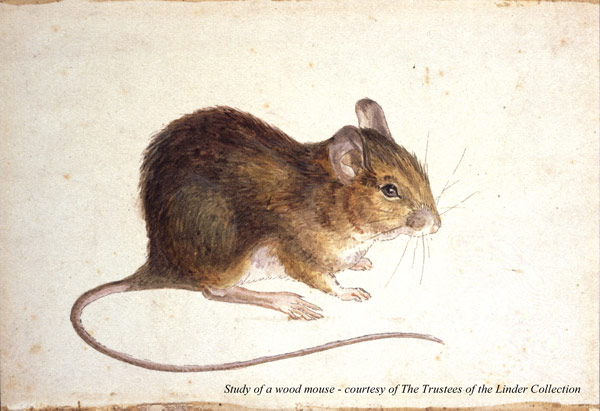
Where is `mouse`? mouse is located at coordinates (340, 230).